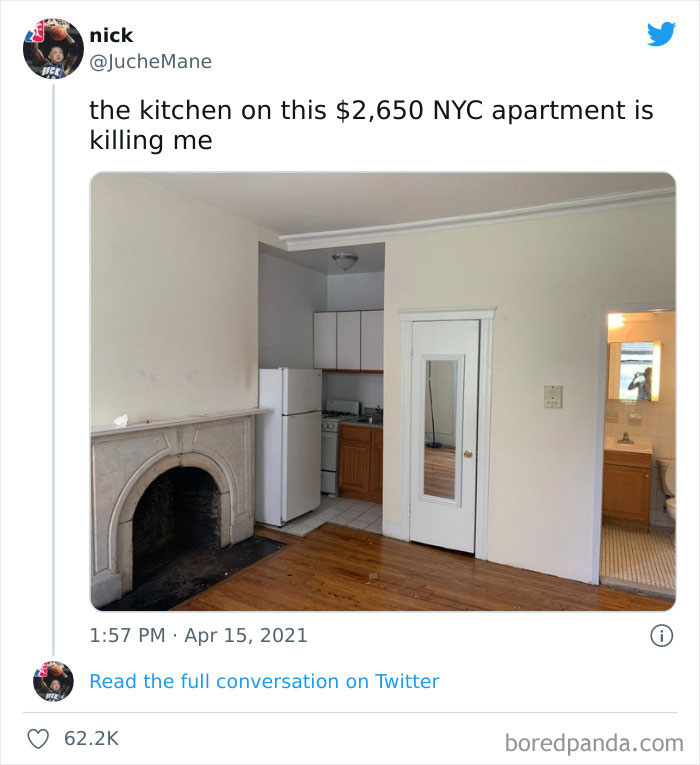
Locate an element on the screen. The image size is (700, 765). mirror is located at coordinates (629, 350).